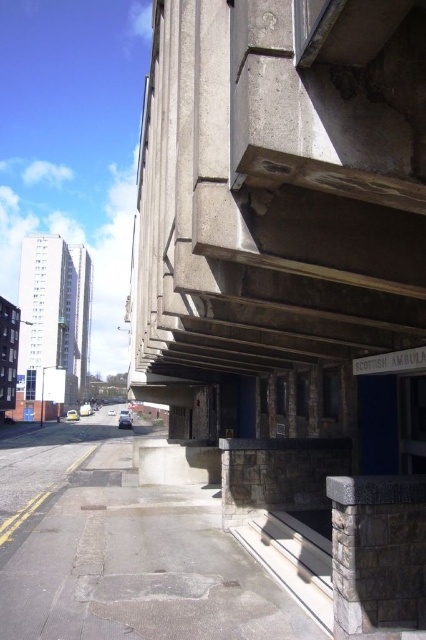
Is concrete at upper right to the left of gray stone pillar at lower right from the viewer's perspective?

Yes, concrete at upper right is to the left of gray stone pillar at lower right.

Between concrete at upper right and gray stone pillar at lower right, which one appears on the right side from the viewer's perspective?

gray stone pillar at lower right is more to the right.

Between point (308, 74) and point (386, 522), which one is positioned in front?

Point (308, 74) is more forward.

You are a GUI agent. You are given a task and a screenshot of the screen. Output one action in this format:
    pyautogui.click(x=<x>, y=<y>)
    Task: Click on the concrete at upper right
    The height and width of the screenshot is (640, 426).
    Given the screenshot: What is the action you would take?
    pyautogui.click(x=278, y=189)